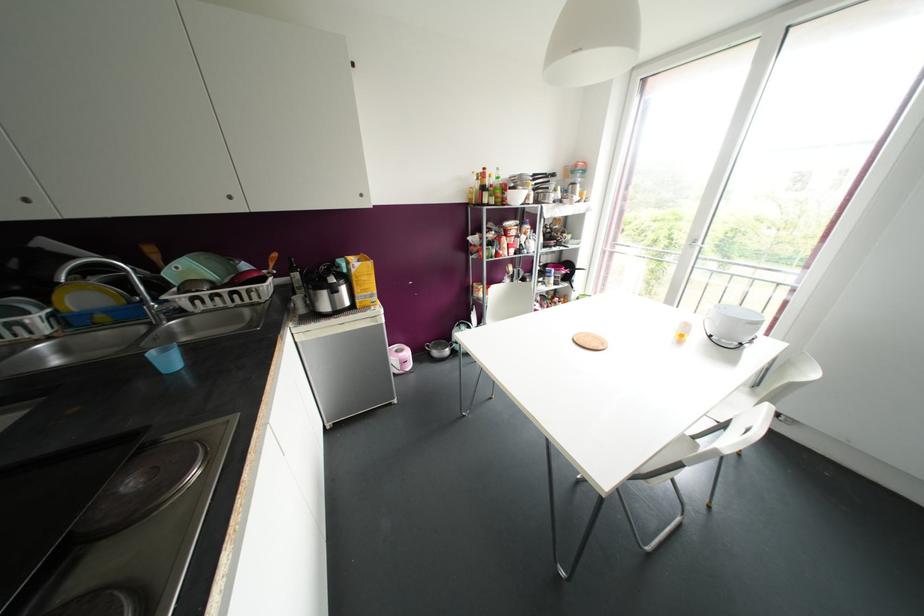
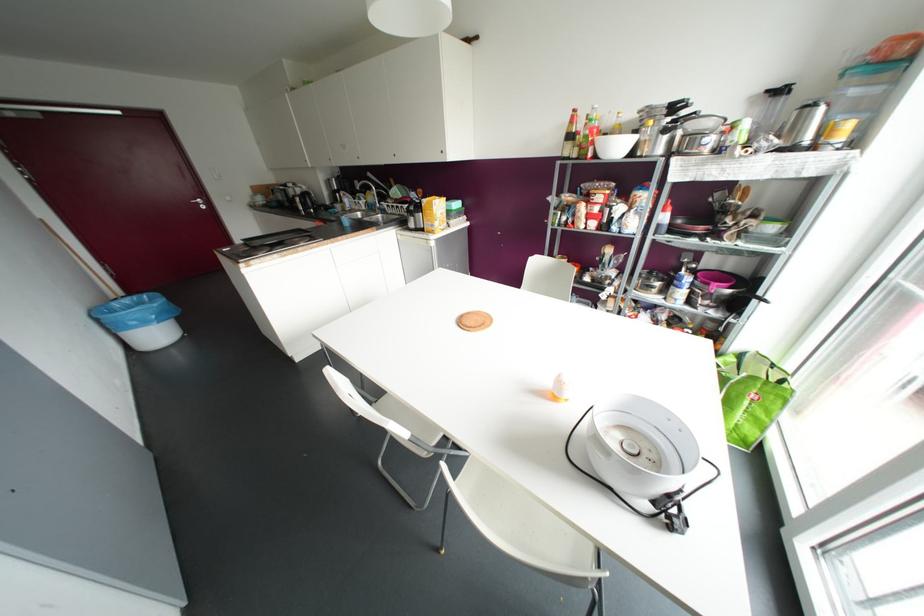
Find the pixel in the second image that matches the point at 533,176 in the first image.

(673, 107)